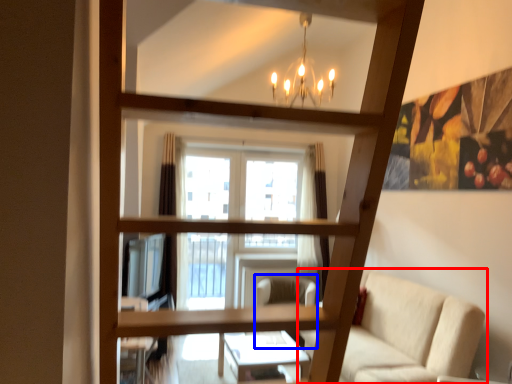
Question: Which object is further to the camera taking this photo, studio couch (highlighted by a red box) or swivel chair (highlighted by a blue box)?

Choices:
 (A) studio couch
 (B) swivel chair

Answer: (B)